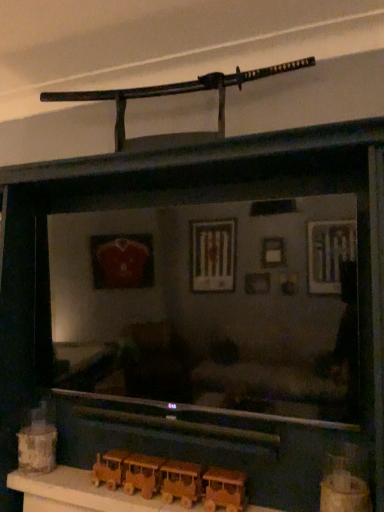
Question: Relative to wooden train set at lower center, is wooden train at lower center, the 2th toy from the left, in front or behind?

Choices:
 (A) front
 (B) behind

Answer: (B)

Question: Is point (231, 499) positioned closer to the camera than point (86, 497)?

Choices:
 (A) farther
 (B) closer

Answer: (B)

Question: Which of these objects is positioned farthest from the wooden train at lower center, arranged as the second toy when viewed from the right?

Choices:
 (A) wooden toy train at lower left, which is counted as the 3th toy, starting from the front
 (B) wooden train set at lower center
 (C) wooden train at lower center, the first toy when ordered from right to left

Answer: (C)

Question: Estimate the real-world distances between objects in this image. Which object is farther from the wooden train at lower center, which appears as the 3th toy when viewed from the left?

Choices:
 (A) wooden toy train at lower left, the first toy viewed from the left
 (B) wooden train at lower center, arranged as the second toy when viewed from the right
 (C) wooden train set at lower center

Answer: (A)